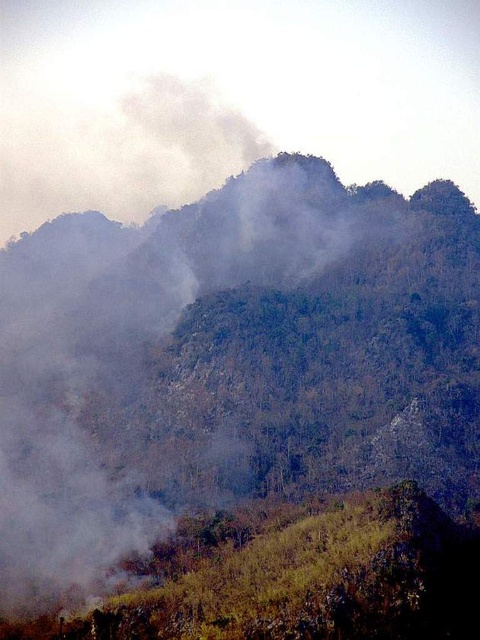
You are a firefighter trying to navigate through the mountainous landscape depicted in the image. You need to reach a safe zone located at point coordinates (140, 358). However, the area around this point is filled with thick white smoke. Based on the scene description, what obstacle might hinder your path to this point?

The point at coordinates (140, 358) is on white smoke at center, so thick white smoke is obstructing the path to that point.

You are a firefighter assessing the mountain fire scene. You notice two areas of white smoke at center and white smoke at upper center. Which smoke area is more dense?

The white smoke at upper center is more dense than the white smoke at center.

From the picture: You are a firefighter trying to locate the source of the fire in the mountainous landscape. You see two areas of white smoke at center and white smoke at upper center. Which direction should you move to reach the smoke closer to the right side?

The white smoke at center is to the right of white smoke at upper center, so you should move towards the white smoke at center to reach the smoke closer to the right side.